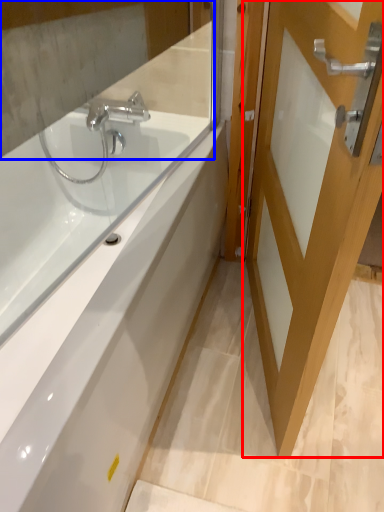
Question: Which of the following is the farthest to the observer, door (highlighted by a red box) or mirror (highlighted by a blue box)?

Choices:
 (A) door
 (B) mirror

Answer: (B)